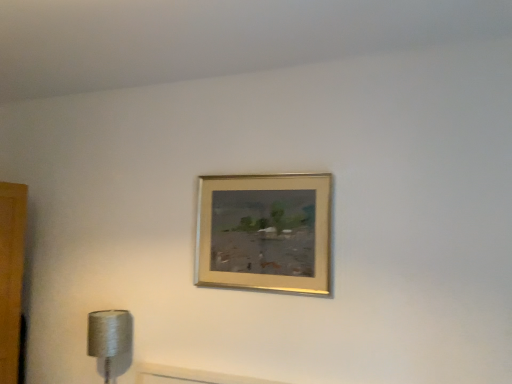
Question: Is silver metallic lamp at lower left to the right of gold metallic picture frame at upper center from the viewer's perspective?

Choices:
 (A) yes
 (B) no

Answer: (B)

Question: Considering the relative sizes of silver metallic lamp at lower left and gold metallic picture frame at upper center in the image provided, is silver metallic lamp at lower left shorter than gold metallic picture frame at upper center?

Choices:
 (A) yes
 (B) no

Answer: (A)

Question: Would you say silver metallic lamp at lower left is outside gold metallic picture frame at upper center?

Choices:
 (A) yes
 (B) no

Answer: (A)

Question: From the image's perspective, is silver metallic lamp at lower left over gold metallic picture frame at upper center?

Choices:
 (A) yes
 (B) no

Answer: (B)

Question: From a real-world perspective, is silver metallic lamp at lower left beneath gold metallic picture frame at upper center?

Choices:
 (A) no
 (B) yes

Answer: (B)

Question: From the image's perspective, would you say silver metallic lamp at lower left is shown under gold metallic picture frame at upper center?

Choices:
 (A) no
 (B) yes

Answer: (B)

Question: Is gold metallic picture frame at upper center not close to silver metallic lamp at lower left?

Choices:
 (A) no
 (B) yes

Answer: (A)

Question: Does gold metallic picture frame at upper center appear on the left side of silver metallic lamp at lower left?

Choices:
 (A) no
 (B) yes

Answer: (A)

Question: Can you confirm if gold metallic picture frame at upper center is shorter than silver metallic lamp at lower left?

Choices:
 (A) yes
 (B) no

Answer: (B)

Question: Considering the relative sizes of gold metallic picture frame at upper center and silver metallic lamp at lower left in the image provided, is gold metallic picture frame at upper center thinner than silver metallic lamp at lower left?

Choices:
 (A) no
 (B) yes

Answer: (B)

Question: Can you confirm if gold metallic picture frame at upper center is taller than silver metallic lamp at lower left?

Choices:
 (A) no
 (B) yes

Answer: (B)

Question: Is gold metallic picture frame at upper center outside silver metallic lamp at lower left?

Choices:
 (A) yes
 (B) no

Answer: (A)

Question: From their relative heights in the image, would you say silver metallic lamp at lower left is taller or shorter than gold metallic picture frame at upper center?

Choices:
 (A) tall
 (B) short

Answer: (B)